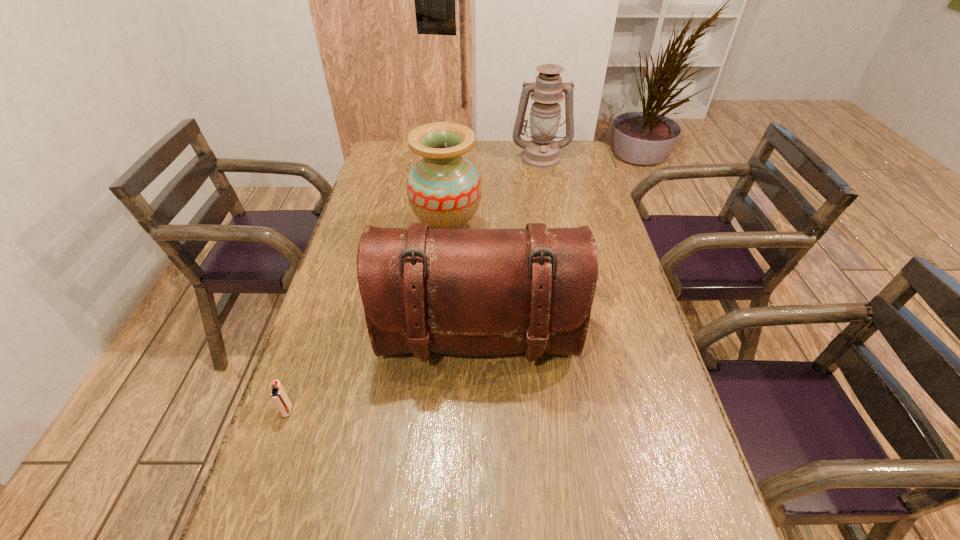
Locate an element on the screen. The width and height of the screenshot is (960, 540). the farthest object is located at coordinates (542, 152).

The width and height of the screenshot is (960, 540). Find the location of `vase`. vase is located at coordinates (444, 189).

Locate an element on the screen. Image resolution: width=960 pixels, height=540 pixels. the second nearest object is located at coordinates (476, 292).

This screenshot has height=540, width=960. Identify the location of the leftmost object. (278, 395).

In order to click on igniter in this screenshot , I will do `click(278, 395)`.

The height and width of the screenshot is (540, 960). Identify the location of vacant space located 0.080m on the left of the oil lamp. (492, 158).

You are a GUI agent. You are given a task and a screenshot of the screen. Output one action in this format:
    pyautogui.click(x=<x>, y=<y>)
    Task: Click on the vacant space located on the front of the vase
    This screenshot has width=960, height=540.
    Given the screenshot: What is the action you would take?
    pyautogui.click(x=444, y=281)

Locate an element on the screen. The image size is (960, 540). vacant space located 0.310m on the front-facing side of the third farthest object is located at coordinates (477, 528).

You are a GUI agent. You are given a task and a screenshot of the screen. Output one action in this format:
    pyautogui.click(x=<x>, y=<y>)
    Task: Click on the vacant space located 0.090m on the right of the shortest object
    This screenshot has height=540, width=960.
    Given the screenshot: What is the action you would take?
    pyautogui.click(x=332, y=410)

Find the location of a particular element. This screenshot has width=960, height=540. object positioned at the far edge is located at coordinates (542, 152).